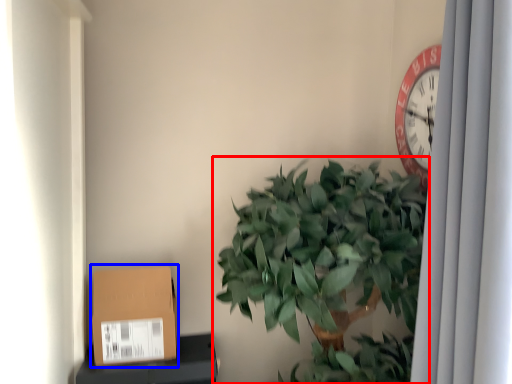
Question: Which point is further to the camera, houseplant (highlighted by a red box) or cardboard box (highlighted by a blue box)?

Choices:
 (A) houseplant
 (B) cardboard box

Answer: (B)